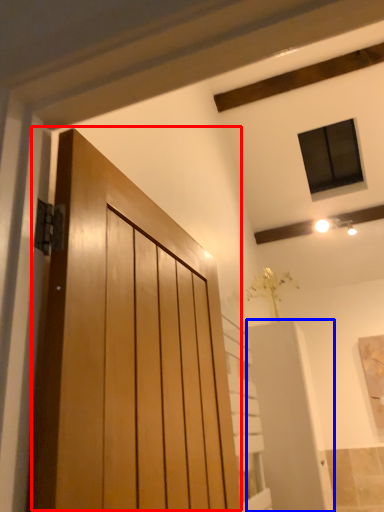
Question: Which object appears closest to the camera in this image, door (highlighted by a red box) or elevator (highlighted by a blue box)?

Choices:
 (A) door
 (B) elevator

Answer: (A)